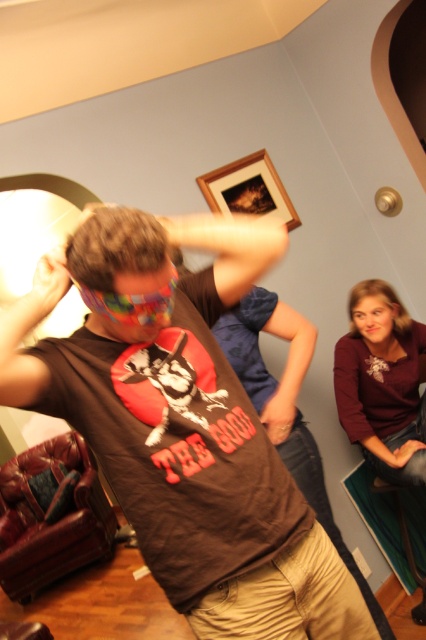
Question: From the image, what is the correct spatial relationship of brown matte t-shirt at center in relation to matte brown hand at center?

Choices:
 (A) left
 (B) right

Answer: (A)

Question: Which object appears closest to the camera in this image?

Choices:
 (A) matte plastic mask at center
 (B) wooden frame at upper center
 (C) brown matte t-shirt at center

Answer: (C)

Question: Does brown matte t-shirt at center appear over wooden frame at upper center?

Choices:
 (A) yes
 (B) no

Answer: (B)

Question: Which point is farther to the camera?

Choices:
 (A) (268, 406)
 (B) (233, 467)
 (C) (411, 461)
 (D) (258, 189)

Answer: (D)

Question: In this image, where is matte plastic mask at center located relative to matte brown hand at center?

Choices:
 (A) above
 (B) below

Answer: (A)

Question: Which object is farther from the camera taking this photo?

Choices:
 (A) matte black hand at lower right
 (B) wooden frame at upper center
 (C) matte plastic mask at center

Answer: (B)